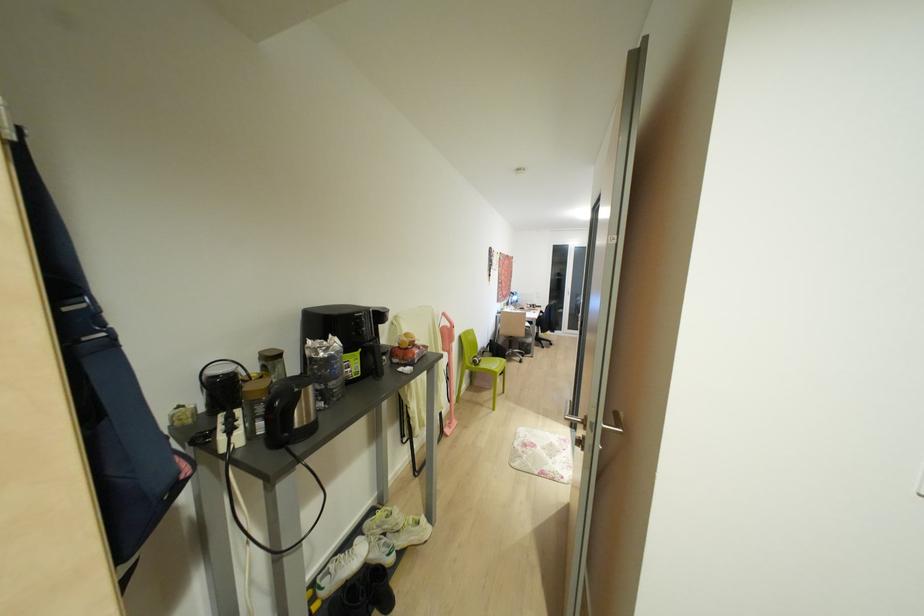
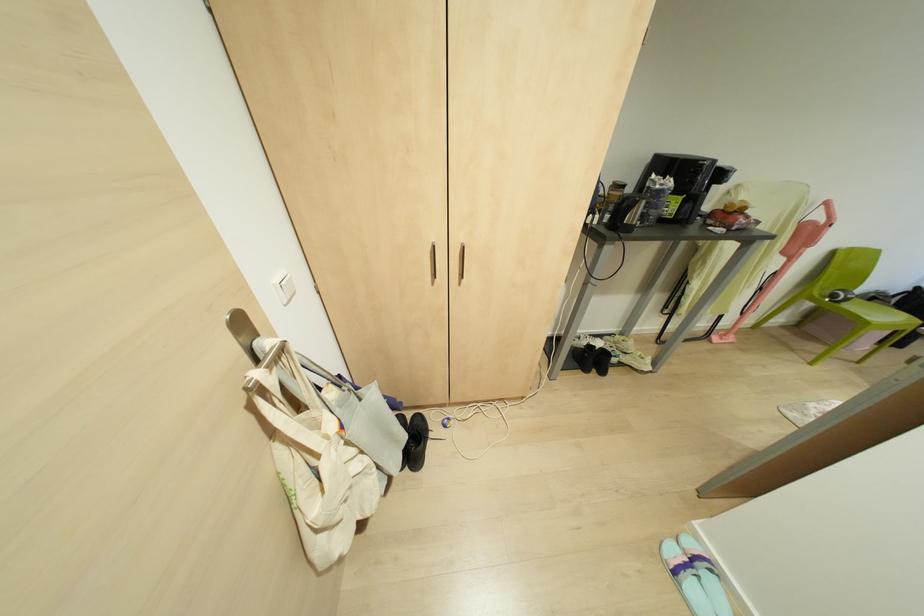
In the second image, find the point that corresponds to (444,314) in the first image.

(825, 203)